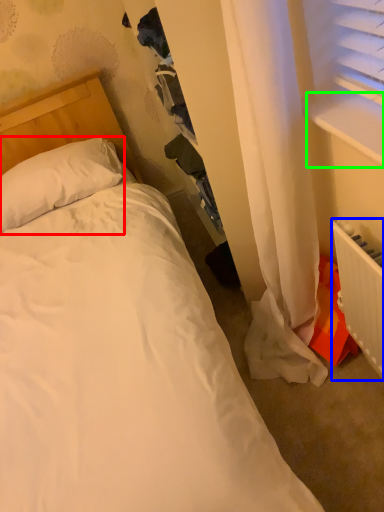
Question: Which is farther away from pillow (highlighted by a red box)? radiator (highlighted by a blue box) or window sill (highlighted by a green box)?

Choices:
 (A) radiator
 (B) window sill

Answer: (A)